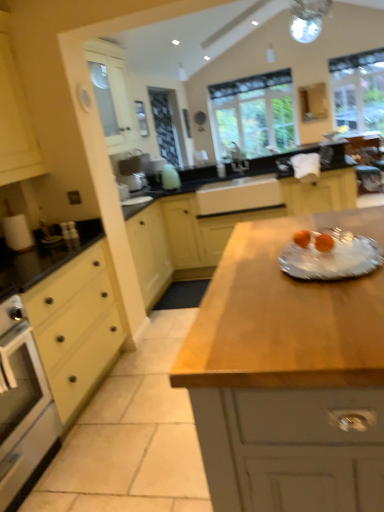
Find the location of a particular element. Image resolution: width=384 pixels, height=512 pixels. vacant space behind clear glass plate at center is located at coordinates (269, 233).